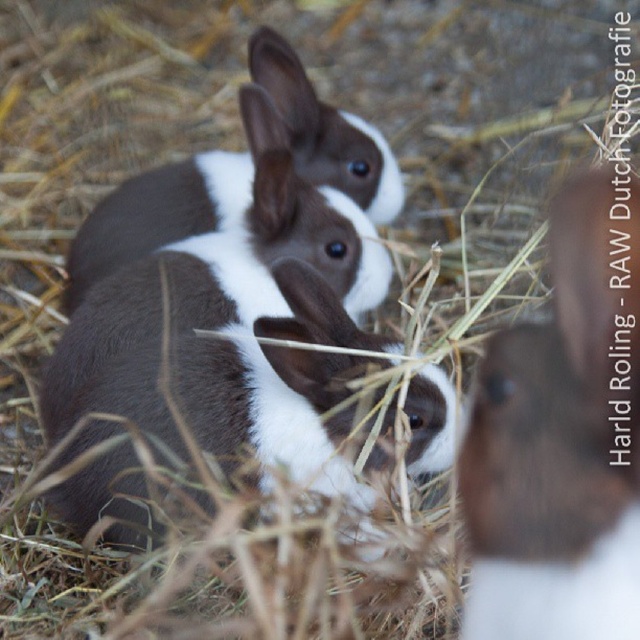
You are a farmer who wants to place a 1 meter long fence panel between the brown fur rabbit at center and the brown and white fur rabbit at center. Based on the scene, will the fence panel fit between them without overlapping either rabbit?

The distance between the brown fur rabbit at center and the brown and white fur rabbit at center is 1.16 meters. Since the fence panel is 1 meter long, it will fit between them with some space remaining, so it won t overlap either rabbit.